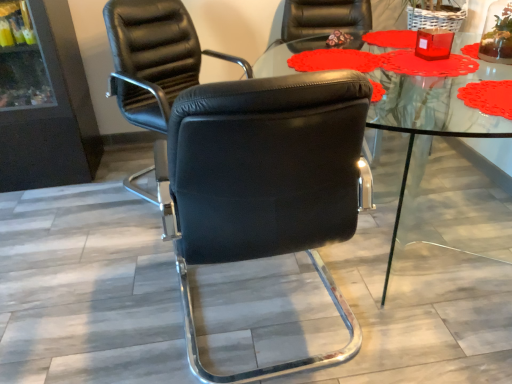
Where is `free region under black leather chair at center, the 1th chair from the front (from a real-world perspective)`? The width and height of the screenshot is (512, 384). free region under black leather chair at center, the 1th chair from the front (from a real-world perspective) is located at coordinates (241, 311).